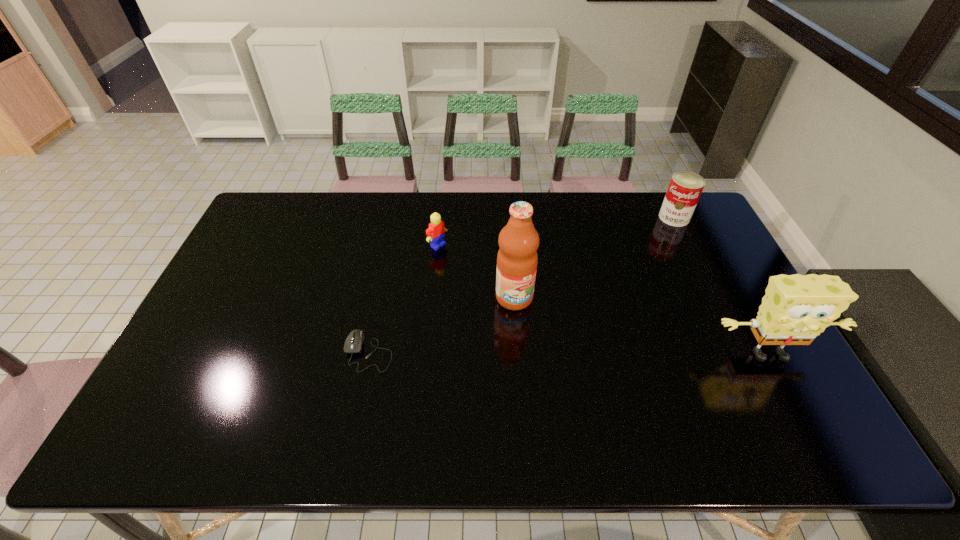
Locate an element on the screen. The width and height of the screenshot is (960, 540). vacant area situated on the face of the sponge is located at coordinates (790, 395).

Where is `vacant space positioned on the front label of the farthest object`? The height and width of the screenshot is (540, 960). vacant space positioned on the front label of the farthest object is located at coordinates (660, 240).

Locate an element on the screen. The width and height of the screenshot is (960, 540). free spot located 0.260m on the front label of the farthest object is located at coordinates (642, 268).

Locate an element on the screen. The width and height of the screenshot is (960, 540). vacant space located on the front label of the farthest object is located at coordinates (626, 295).

Identify the location of free space located on the front-facing side of the second shortest object. The image size is (960, 540). (510, 296).

Where is `blank area located on the front-facing side of the second shortest object`? The image size is (960, 540). blank area located on the front-facing side of the second shortest object is located at coordinates (479, 274).

Image resolution: width=960 pixels, height=540 pixels. I want to click on free space located 0.340m on the front-facing side of the second shortest object, so click(523, 306).

Where is `vacant space located on the front label of the third nearest object`? Image resolution: width=960 pixels, height=540 pixels. vacant space located on the front label of the third nearest object is located at coordinates (561, 372).

The width and height of the screenshot is (960, 540). I want to click on vacant space situated on the front label of the third nearest object, so click(555, 363).

Find the location of a particular element. This screenshot has width=960, height=540. vacant space situated 0.090m on the front label of the third nearest object is located at coordinates (537, 334).